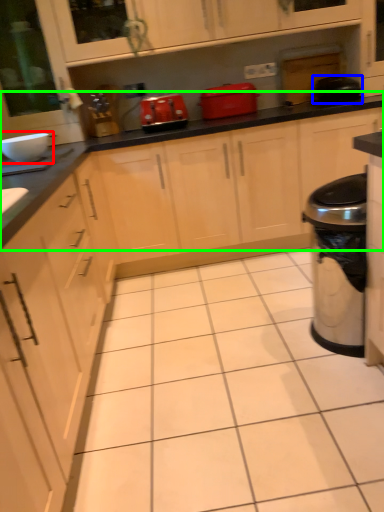
Question: Considering the real-world distances, which object is closest to appliance (highlighted by a red box)? appliance (highlighted by a blue box) or countertop (highlighted by a green box).

Choices:
 (A) appliance
 (B) countertop

Answer: (B)